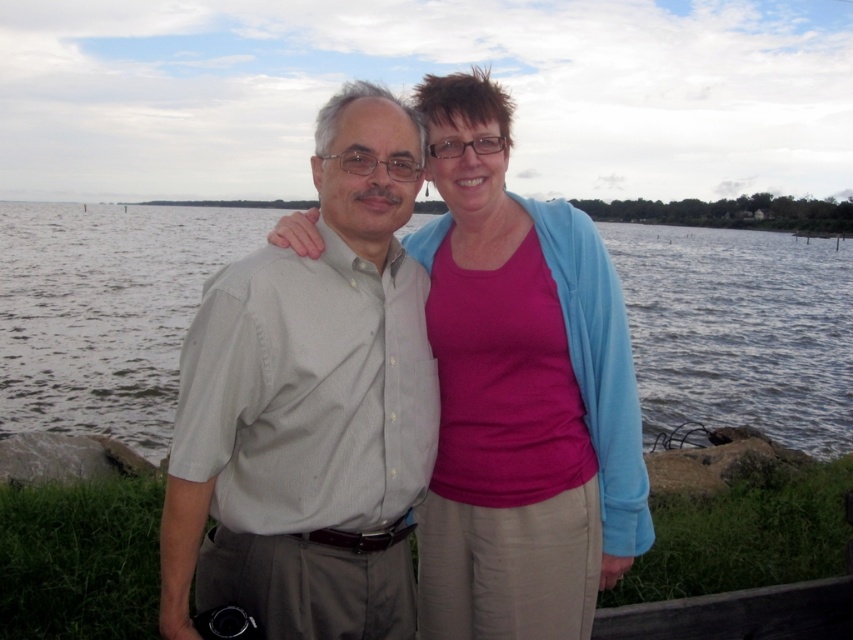
Is pink matte shirt at center shorter than clear water at center?

Yes, pink matte shirt at center is shorter than clear water at center.

The width and height of the screenshot is (853, 640). In order to click on pink matte shirt at center in this screenshot , I will do 520,394.

Does light gray shirt at center appear under clear water at center?

Correct, light gray shirt at center is located below clear water at center.

Looking at this image, between light gray shirt at center and clear water at center, which one appears on the left side from the viewer's perspective?

clear water at center is more to the left.

Is point (386, 161) behind point (80, 333)?

No, (386, 161) is closer to viewer.

Find the location of a particular element. light gray shirt at center is located at coordinates (310, 406).

Looking at this image, between light gray shirt at center and pink matte shirt at center, which one has more height?

With more height is light gray shirt at center.

Is light gray shirt at center thinner than pink matte shirt at center?

Incorrect, light gray shirt at center's width is not less than pink matte shirt at center's.

Does point (361, 208) come farther from viewer compared to point (438, 452)?

No, (361, 208) is in front of (438, 452).

Locate an element on the screen. The image size is (853, 640). light gray shirt at center is located at coordinates (310, 406).